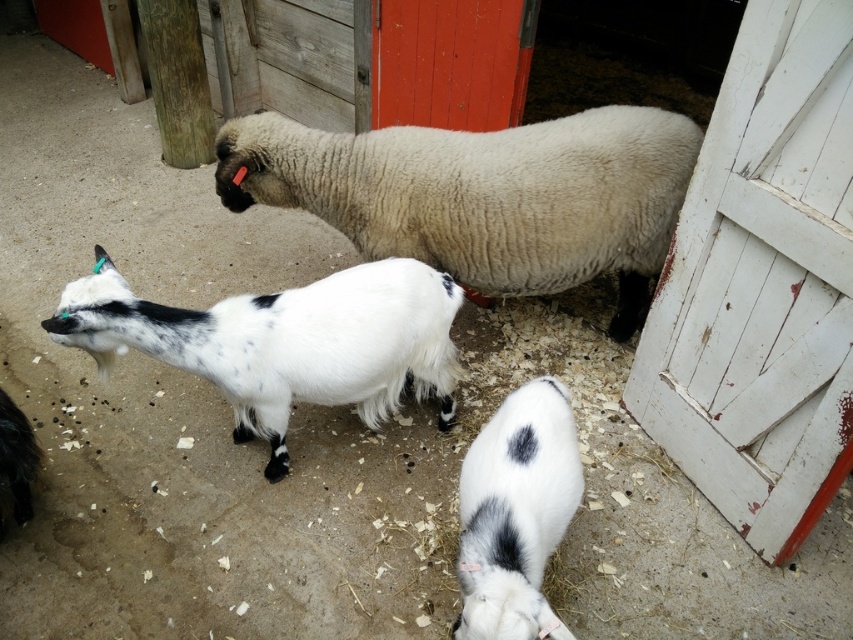
Question: Which object appears farthest from the camera in this image?

Choices:
 (A) white soft fur goat at lower center
 (B) white speckled fur goat at center
 (C) white woolen sheep at center

Answer: (C)

Question: Which point is closer to the camera?

Choices:
 (A) white speckled fur goat at center
 (B) white soft fur goat at lower center
 (C) white woolen sheep at center

Answer: (B)

Question: Does white woolen sheep at center appear on the right side of white soft fur goat at lower center?

Choices:
 (A) no
 (B) yes

Answer: (A)

Question: Which of the following is the closest to the observer?

Choices:
 (A) (529, 554)
 (B) (338, 401)
 (C) (485, 246)

Answer: (A)

Question: Can you confirm if white woolen sheep at center is bigger than white soft fur goat at lower center?

Choices:
 (A) no
 (B) yes

Answer: (B)

Question: Observing the image, what is the correct spatial positioning of white woolen sheep at center in reference to white soft fur goat at lower center?

Choices:
 (A) above
 (B) below

Answer: (A)